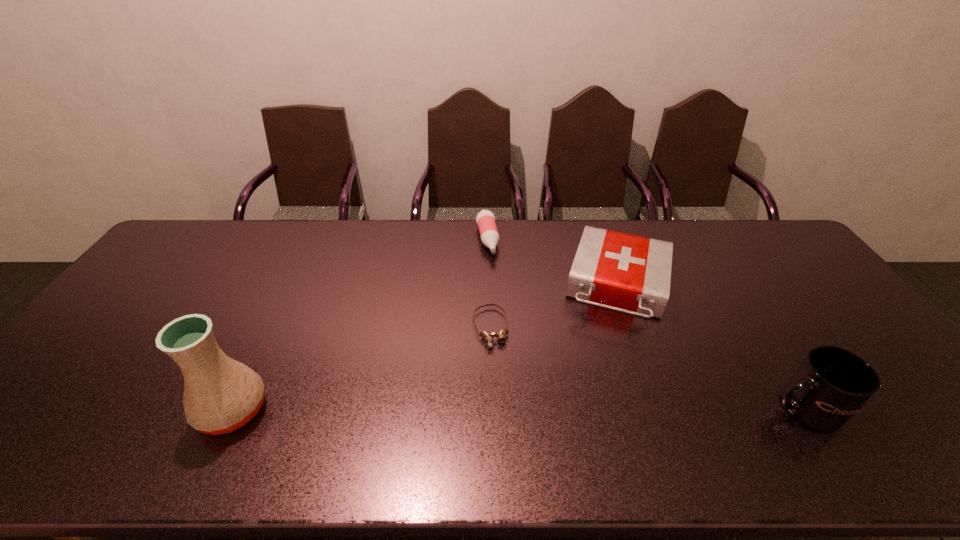
In the image, there is a desktop. Identify the location of vacant space at the near right corner. (876, 395).

The image size is (960, 540). What are the coordinates of `blank region between the shortest object and the second tallest object` in the screenshot? It's located at (647, 368).

Where is `empty location between the shortest object and the third shortest object`? The height and width of the screenshot is (540, 960). empty location between the shortest object and the third shortest object is located at coordinates (555, 307).

At what (x,y) coordinates should I click in order to perform the action: click on empty location between the leftmost object and the third tallest object. Please return your answer as a coordinate pair (x, y). The height and width of the screenshot is (540, 960). Looking at the image, I should click on (426, 348).

The width and height of the screenshot is (960, 540). In order to click on free space between the leftmost object and the second shortest object in this screenshot , I will do click(360, 325).

At what (x,y) coordinates should I click in order to perform the action: click on vacant area between the mug and the second shortest object. Please return your answer as a coordinate pair (x, y). The image size is (960, 540). Looking at the image, I should click on (645, 324).

At what (x,y) coordinates should I click in order to perform the action: click on free space that is in between the pottery and the mug. Please return your answer as a coordinate pair (x, y). Looking at the image, I should click on (517, 409).

Identify the location of empty space between the first-aid kit and the goggles. The width and height of the screenshot is (960, 540). (555, 307).

Identify the location of vacant space in between the rightmost object and the second shortest object. (645, 324).

Find the location of a particular element. vacant area that lies between the pottery and the second tallest object is located at coordinates (517, 409).